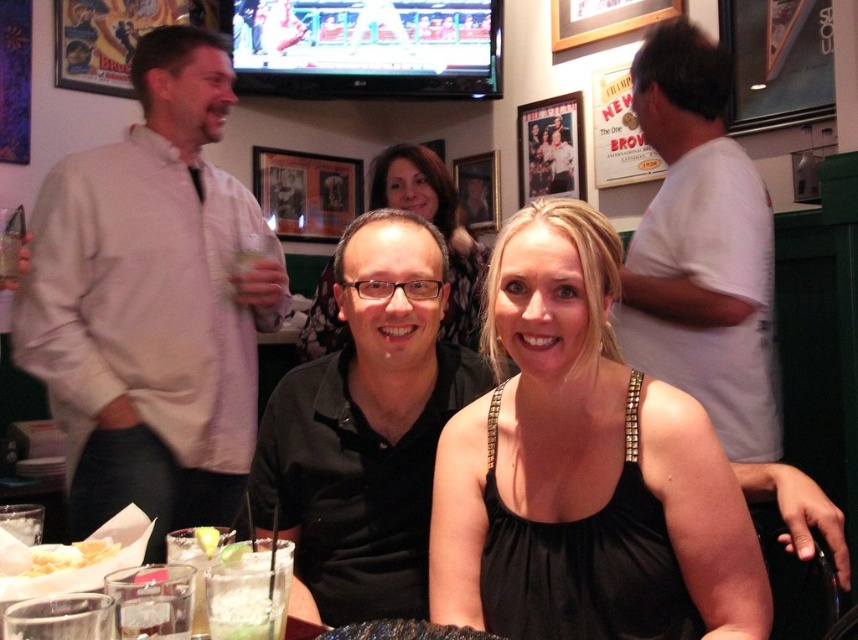
You are a photographer standing behind the table in the scene. You want to take a photo of the white shirt at left without the white crispy fries at lower left appearing in the frame. Is this possible based on their positions?

The white shirt at left is located above the white crispy fries at lower left, so if you position the camera to focus on the upper part of the scene where the white shirt at left is placed, you can exclude the white crispy fries at lower left from the frame.

You are a photographer standing in the scene. You want to take a photo of the white shirt at left and the white crispy fries at lower left. Which object should you focus on first if you want to capture both in the same frame without moving the camera?

The white shirt at left is much taller than the white crispy fries at lower left, so you should focus on the white shirt at left first to ensure it is in focus before the fries, as it is larger in the frame.

You are a waiter in a busy restaurant and need to deliver a plate of food to the table. The table has a white shirt at left and white crispy fries at lower left. Where should you place the plate to avoid blocking the view between the two items?

Place the plate to the right of the white shirt at left and to the left of the white crispy fries at lower left, ensuring it doesn not block the view between them.